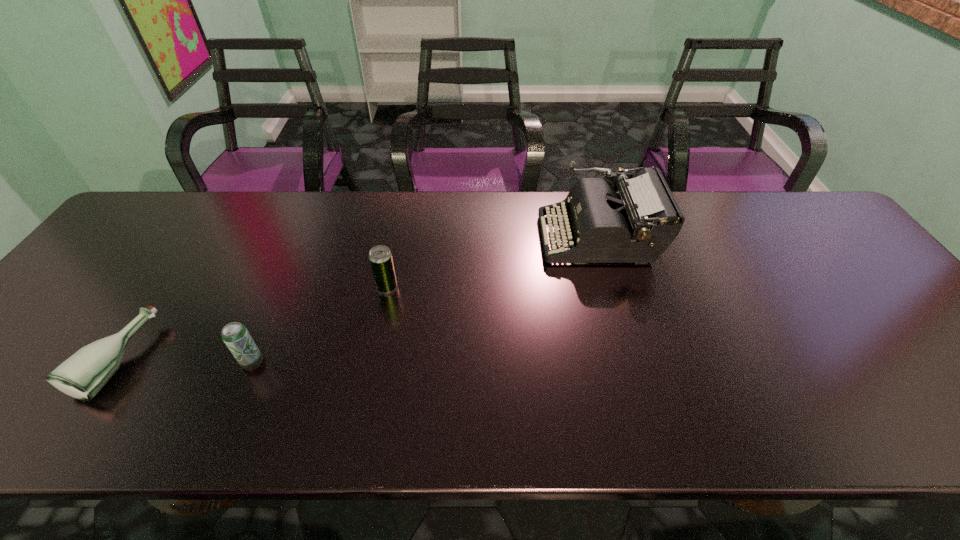
Find the location of `typewriter`. typewriter is located at coordinates (636, 225).

Find the location of a particular element. Image resolution: width=960 pixels, height=540 pixels. the rightmost object is located at coordinates (636, 225).

Find the location of a particular element. Image resolution: width=960 pixels, height=540 pixels. the third object from left to right is located at coordinates (380, 257).

Locate an element on the screen. the third nearest object is located at coordinates (380, 257).

You are a GUI agent. You are given a task and a screenshot of the screen. Output one action in this format:
    pyautogui.click(x=<x>, y=<y>)
    Task: Click on the third object from right to left
    
    Given the screenshot: What is the action you would take?
    pyautogui.click(x=235, y=335)

Locate an element on the screen. This screenshot has height=540, width=960. the nearer beer can is located at coordinates (235, 335).

The height and width of the screenshot is (540, 960). I want to click on bottle, so click(81, 376).

The height and width of the screenshot is (540, 960). In order to click on the leftmost object in this screenshot , I will do `click(81, 376)`.

Find the location of a particular element. The image size is (960, 540). vacant area located 0.140m on the front-facing side of the typewriter is located at coordinates (492, 237).

Locate an element on the screen. The width and height of the screenshot is (960, 540). vacant space positioned on the front-facing side of the typewriter is located at coordinates (475, 237).